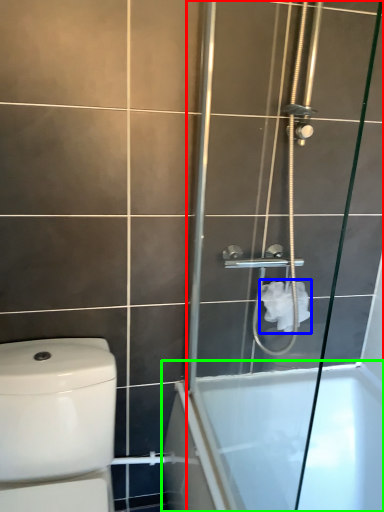
Question: Estimate the real-world distances between objects in this image. Which object is farther from screen door (highlighted by a red box), toilet paper (highlighted by a blue box) or bathtub (highlighted by a green box)?

Choices:
 (A) toilet paper
 (B) bathtub

Answer: (A)